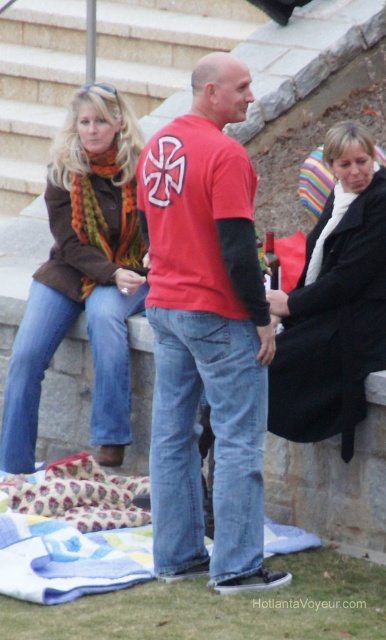
You are a photographer trying to capture a candid shot of the two people on the bench. The multicolored scarf at upper left and the black wool coat at center are in your viewfinder. Which object is positioned higher in the frame?

The multicolored scarf at upper left is positioned higher in the frame because it is above the black wool coat at center.